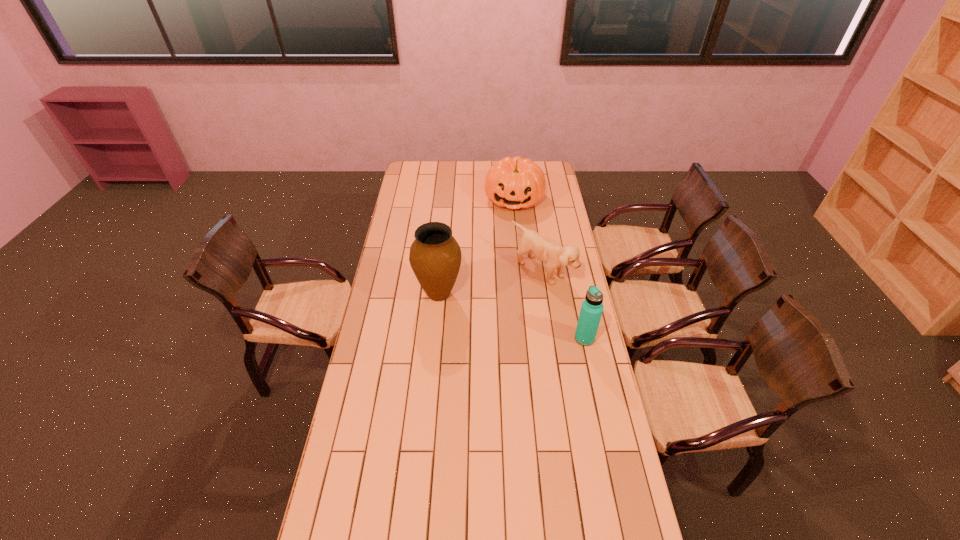
I want to click on vacant position in the image that satisfies the following two spatial constraints: 1. on the back side of the tallest object; 2. on the right side of the puppy, so click(441, 271).